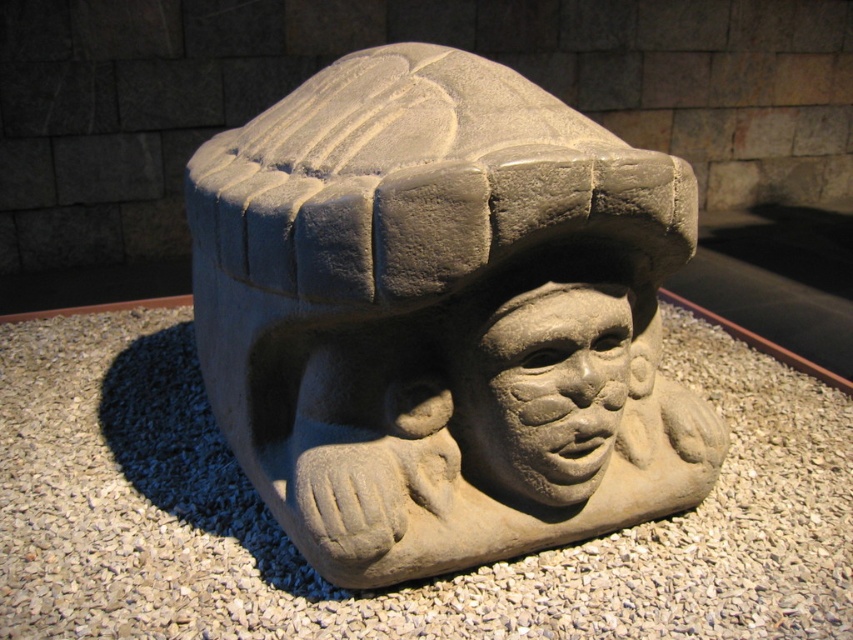
Question: Does gray stone carving at center appear under gray gravel at center?

Choices:
 (A) no
 (B) yes

Answer: (A)

Question: Does gray stone carving at center appear on the right side of gray stone face at center?

Choices:
 (A) yes
 (B) no

Answer: (B)

Question: Among these objects, which one is farthest from the camera?

Choices:
 (A) gray stone face at center
 (B) gray gravel at center
 (C) gray stone carving at center

Answer: (A)

Question: Which point is farther from the camera taking this photo?

Choices:
 (A) (495, 308)
 (B) (421, 45)

Answer: (B)

Question: Among these objects, which one is nearest to the camera?

Choices:
 (A) gray gravel at center
 (B) gray stone carving at center

Answer: (B)

Question: Does gray gravel at center come behind gray stone face at center?

Choices:
 (A) no
 (B) yes

Answer: (A)